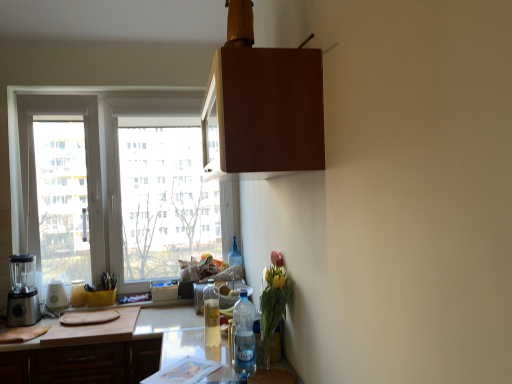
Where is `vacant space situated above wooden cutting board at lower left, marked as the second cabinetry in a front-to-back arrangement (from a real-world perspective)`? The image size is (512, 384). vacant space situated above wooden cutting board at lower left, marked as the second cabinetry in a front-to-back arrangement (from a real-world perspective) is located at coordinates (67, 332).